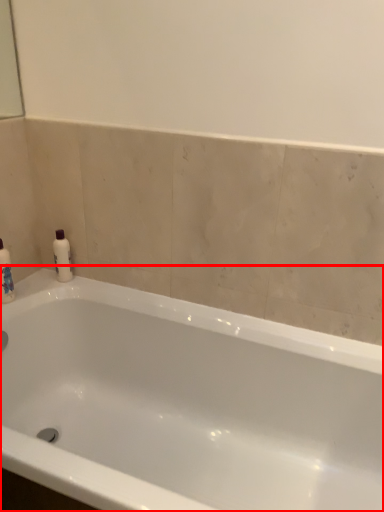
Question: Where is bathtub (annotated by the red box) located in relation to mouthwash in the image?

Choices:
 (A) left
 (B) right

Answer: (B)